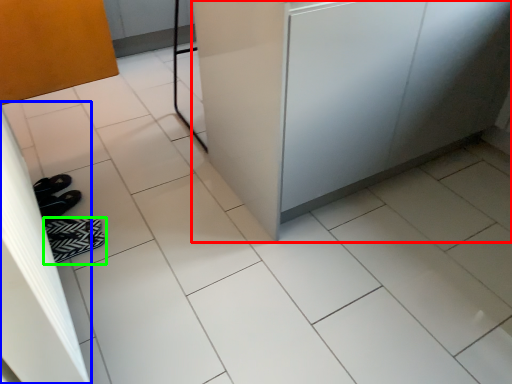
Question: Which is nearer to the counter (highlighted by a red box)? screen door (highlighted by a blue box) or footwear (highlighted by a green box).

Choices:
 (A) screen door
 (B) footwear

Answer: (A)